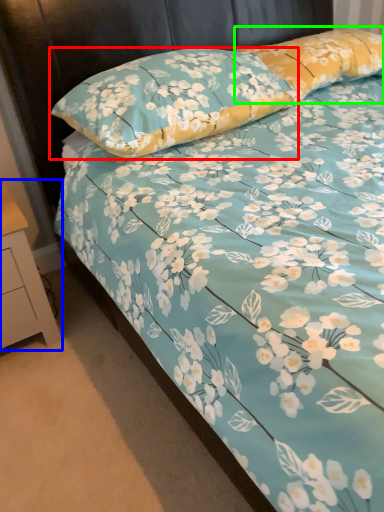
Question: Which object is positioned closest to pillow (highlighted by a red box)? Select from nightstand (highlighted by a blue box) and pillow (highlighted by a green box).

Choices:
 (A) nightstand
 (B) pillow

Answer: (B)